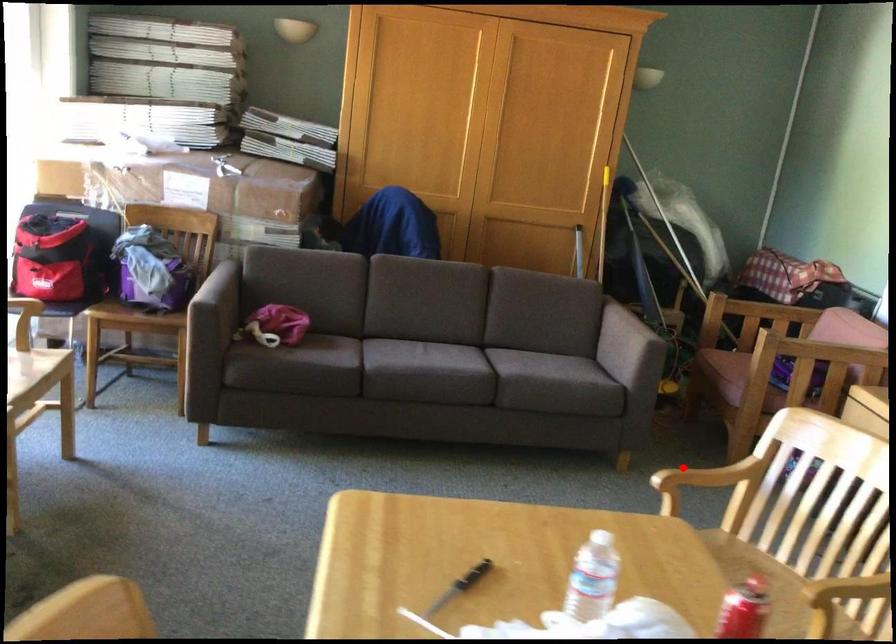
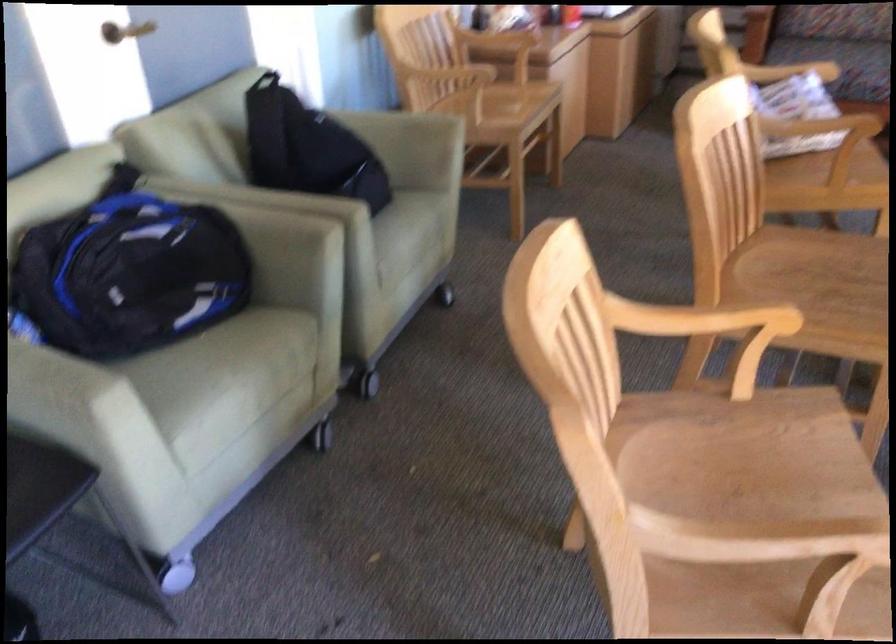
Question: I am providing you with two images of the same scene from different viewpoints. A red point is shown in image1. For the corresponding object point in image2, is it positioned nearer or farther from the camera?

Choices:
 (A) Nearer
 (B) Farther

Answer: (A)